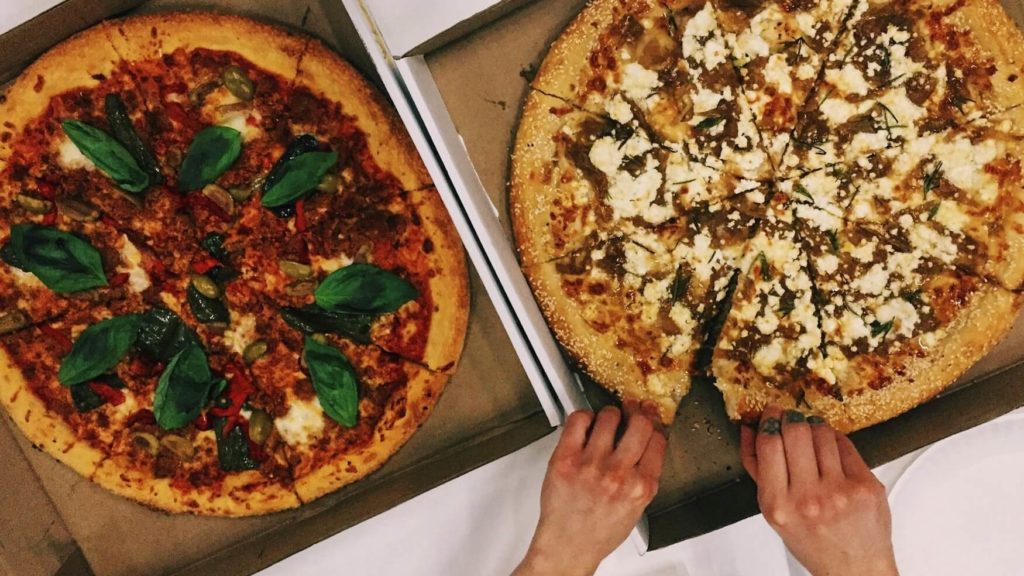
This screenshot has width=1024, height=576. In order to click on table in this screenshot , I will do `click(433, 521)`.